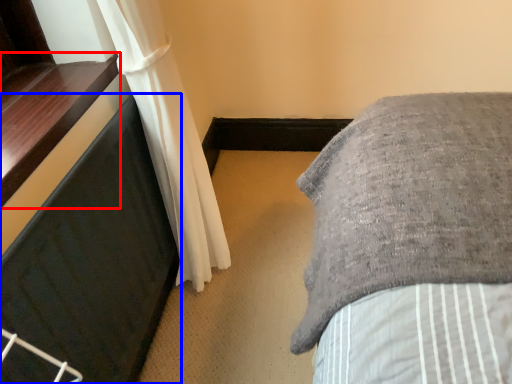
Question: Which object appears closest to the camera in this image, window sill (highlighted by a red box) or furniture (highlighted by a blue box)?

Choices:
 (A) window sill
 (B) furniture

Answer: (B)